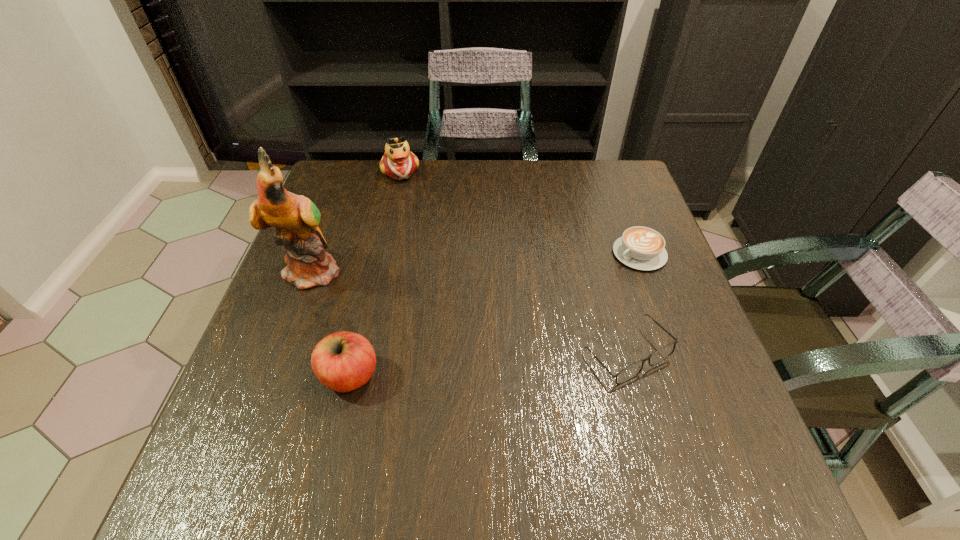
What are the coordinates of `free space between the spectacles and the apple` in the screenshot? It's located at (489, 365).

Find the location of `object that is the third closest to the farthest object`. object that is the third closest to the farthest object is located at coordinates (343, 361).

The image size is (960, 540). I want to click on the fourth closest object to the farthest object, so click(633, 370).

At what (x,y) coordinates should I click in order to perform the action: click on free space in the image that satisfies the following two spatial constraints: 1. on the back side of the apple; 2. on the right side of the duck. Please return your answer as a coordinate pair (x, y). This screenshot has width=960, height=540. Looking at the image, I should click on (397, 171).